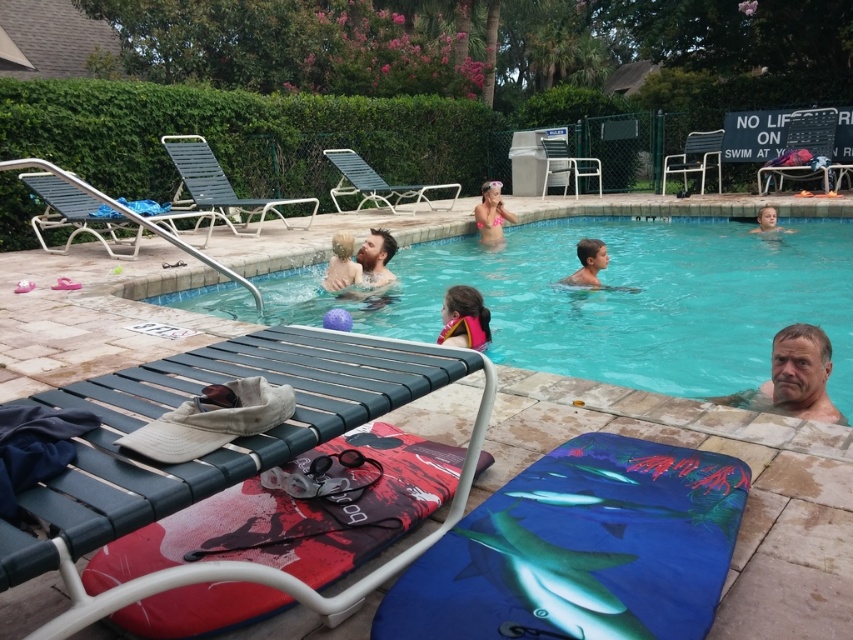
Can you confirm if blue fabric surfboard at lower right is positioned to the left of light brown hair at upper right?

Indeed, blue fabric surfboard at lower right is positioned on the left side of light brown hair at upper right.

Which is in front, point (573, 524) or point (775, 230)?

Positioned in front is point (573, 524).

Is point (527, 499) farther from camera compared to point (752, 230)?

No, (527, 499) is closer to viewer.

Identify the location of blue fabric surfboard at lower right. (581, 548).

Is smooth skin man at center smaller than pink life vest at center?

Incorrect, smooth skin man at center is not smaller in size than pink life vest at center.

I want to click on smooth skin man at center, so click(x=367, y=268).

Image resolution: width=853 pixels, height=640 pixels. Identify the location of smooth skin man at center. (367, 268).

Can you confirm if blue fabric surfboard at lower right is positioned below pink life vest at center?

Yes.

Which is above, blue fabric surfboard at lower right or pink life vest at center?

Positioned higher is pink life vest at center.

Locate an element on the screen. The width and height of the screenshot is (853, 640). blue fabric surfboard at lower right is located at coordinates click(581, 548).

Where is `blue fabric surfboard at lower right`? The width and height of the screenshot is (853, 640). blue fabric surfboard at lower right is located at coordinates (581, 548).